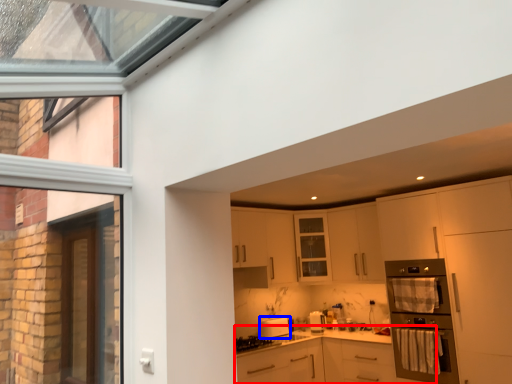
Question: Among these objects, which one is farthest to the camera, cabinetry (highlighted by a red box) or kitchen appliance (highlighted by a blue box)?

Choices:
 (A) cabinetry
 (B) kitchen appliance

Answer: (B)